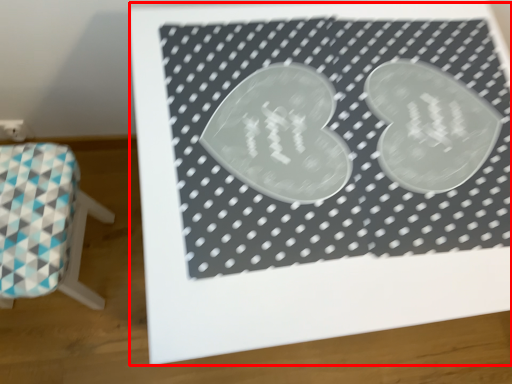
Question: From the image's perspective, what is the correct spatial relationship of bulletin board (annotated by the red box) in relation to furniture?

Choices:
 (A) below
 (B) above

Answer: (B)